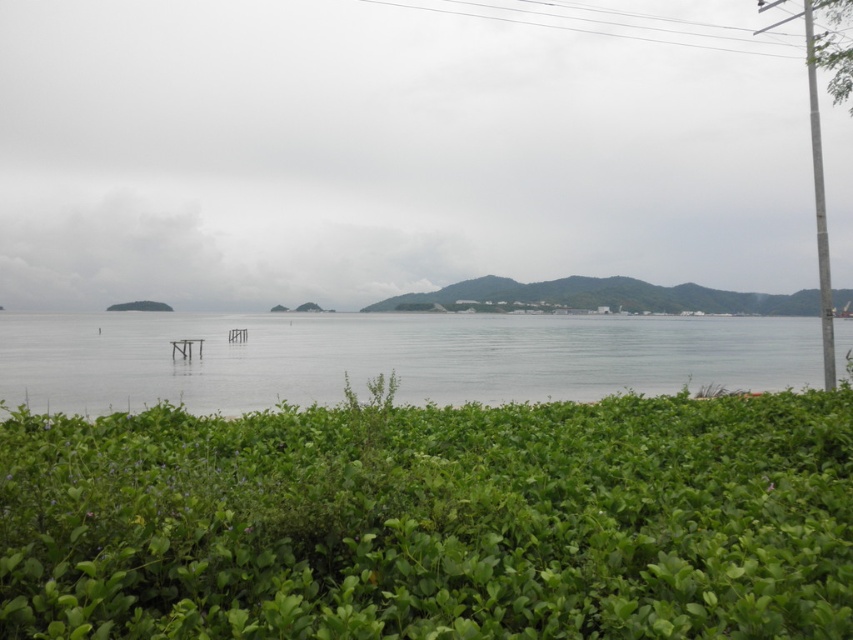
Question: Which object is positioned farthest from the clear water at center?

Choices:
 (A) metallic pole at right
 (B) green leafy hedge at center

Answer: (B)

Question: Which object is closer to the camera taking this photo?

Choices:
 (A) green leafy hedge at center
 (B) metallic pole at right

Answer: (A)

Question: Is green leafy hedge at center below clear water at center?

Choices:
 (A) no
 (B) yes

Answer: (B)

Question: Can you confirm if clear water at center is smaller than metallic pole at right?

Choices:
 (A) no
 (B) yes

Answer: (B)

Question: Among these objects, which one is farthest from the camera?

Choices:
 (A) metallic pole at right
 (B) green leafy hedge at center

Answer: (A)

Question: Does clear water at center appear over metallic pole at right?

Choices:
 (A) yes
 (B) no

Answer: (B)